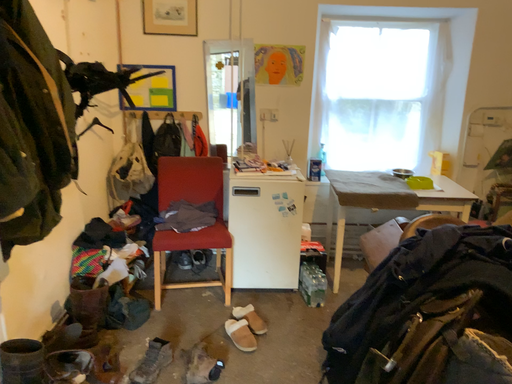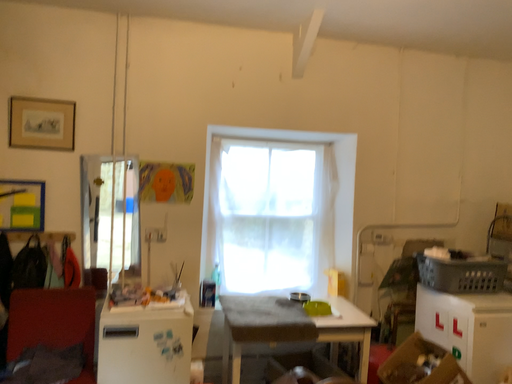
Question: How did the camera likely rotate when shooting the video?

Choices:
 (A) rotated right
 (B) rotated left

Answer: (A)